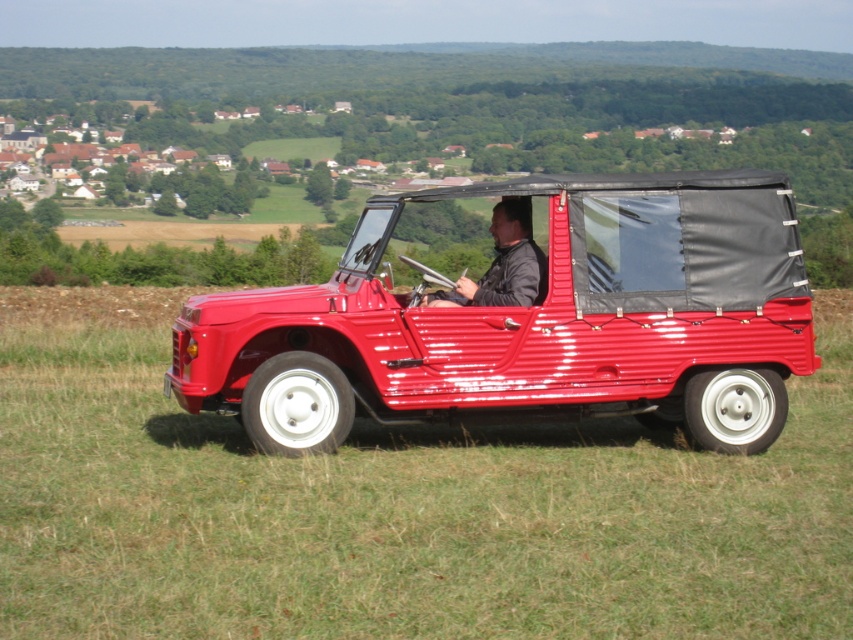
Question: From the image, what is the correct spatial relationship of glossy red jeep at center in relation to leather jacket at center?

Choices:
 (A) below
 (B) above

Answer: (A)

Question: Estimate the real-world distances between objects in this image. Which object is farther from the glossy grass at center?

Choices:
 (A) leather jacket at center
 (B) glossy red jeep at center

Answer: (A)

Question: Which object is closer to the camera taking this photo?

Choices:
 (A) glossy red jeep at center
 (B) glossy grass at center

Answer: (B)

Question: Considering the real-world distances, which object is closest to the glossy red jeep at center?

Choices:
 (A) leather jacket at center
 (B) glossy grass at center

Answer: (A)

Question: Can you confirm if glossy red jeep at center is smaller than leather jacket at center?

Choices:
 (A) yes
 (B) no

Answer: (B)

Question: Considering the relative positions of glossy grass at center and glossy red jeep at center in the image provided, where is glossy grass at center located with respect to glossy red jeep at center?

Choices:
 (A) above
 (B) below

Answer: (B)